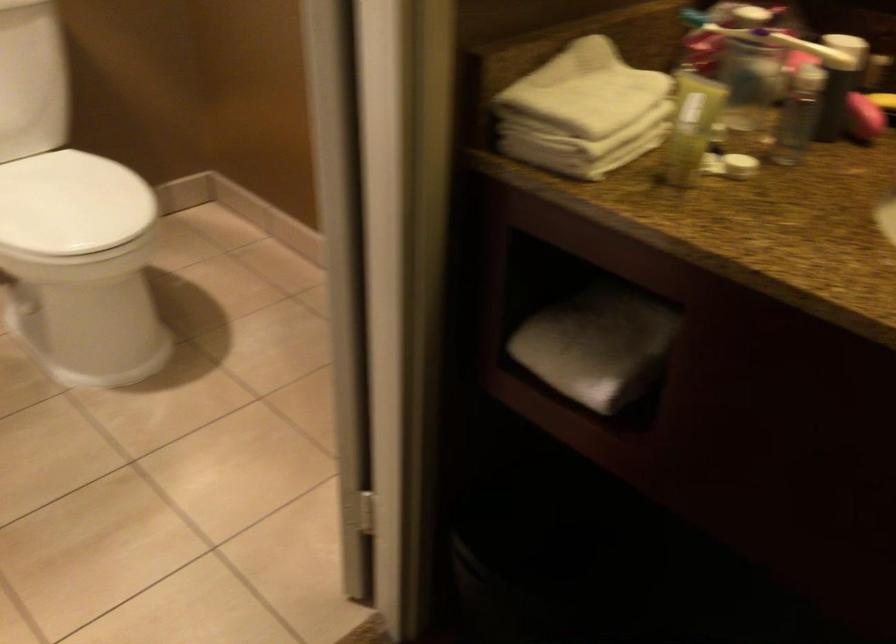
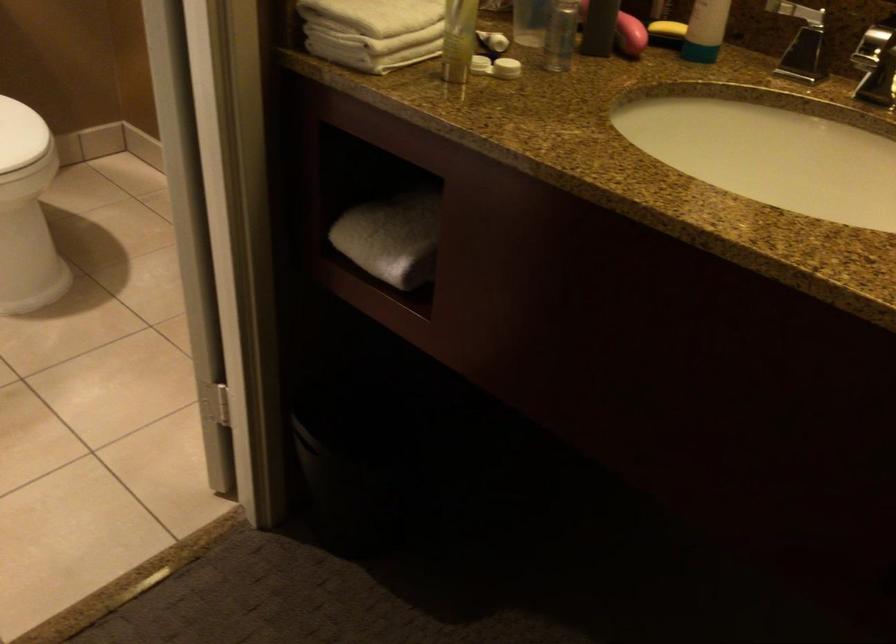
In the second image, find the point that corresponds to [590,353] in the first image.

(392, 238)